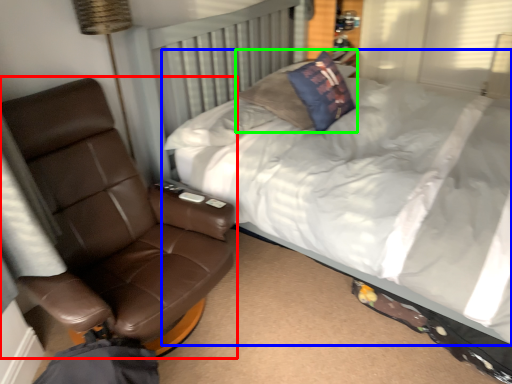
Question: Which object is the closest to the chair (highlighted by a red box)? Choose among these: bed (highlighted by a blue box) or pillow (highlighted by a green box).

Choices:
 (A) bed
 (B) pillow

Answer: (A)